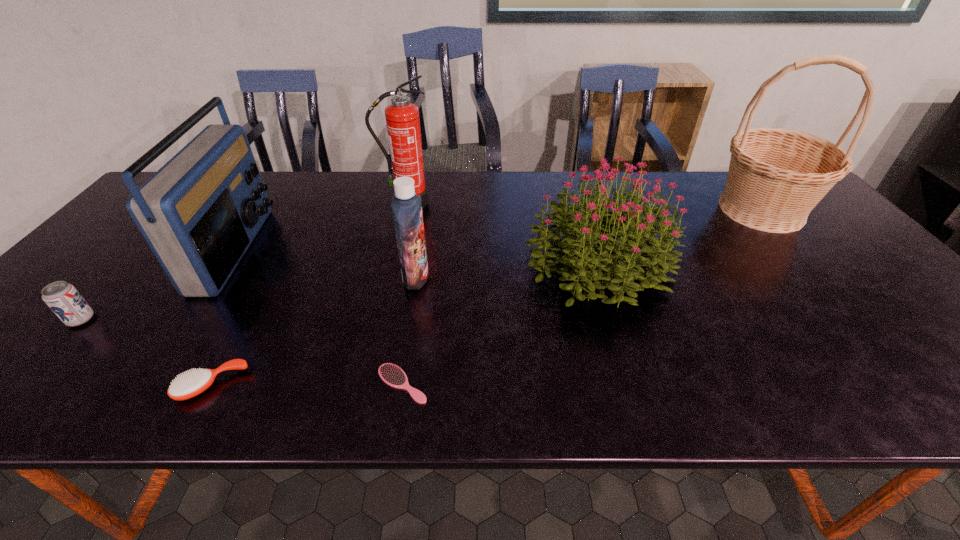
Locate an element on the screen. The image size is (960, 540). free space that satisfies the following two spatial constraints: 1. on the front panel of the seventh object from right to left; 2. on the left side of the right hairbrush is located at coordinates (148, 383).

I want to click on free spot that satisfies the following two spatial constraints: 1. on the front-facing side of the rightmost object; 2. on the left side of the fire extinguisher, so click(x=404, y=210).

The height and width of the screenshot is (540, 960). In order to click on vacant space that satisfies the following two spatial constraints: 1. on the front panel of the radio receiver; 2. on the back side of the left hairbrush in this screenshot , I will do `click(147, 384)`.

I want to click on vacant area that satisfies the following two spatial constraints: 1. on the front-facing side of the fire extinguisher; 2. on the left side of the basket, so click(x=404, y=210).